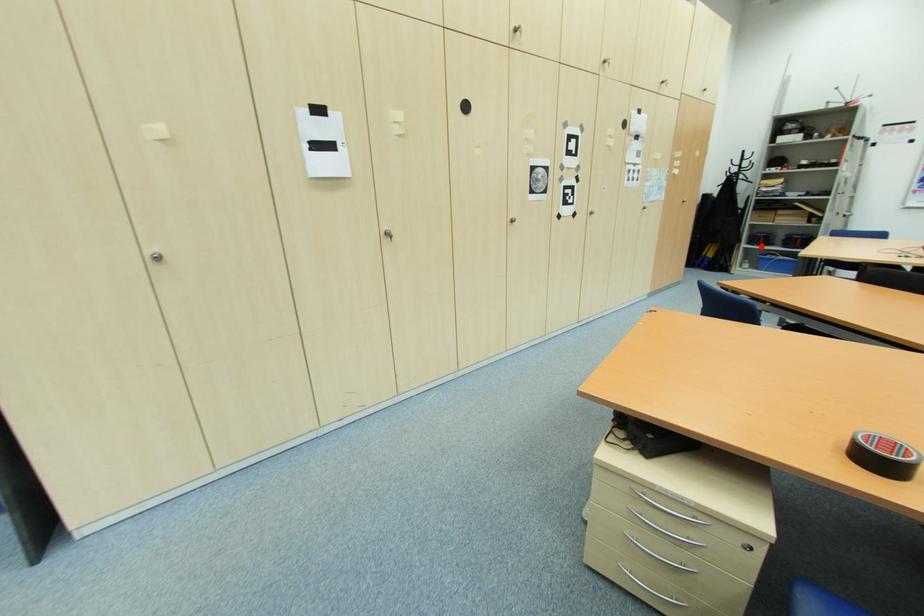
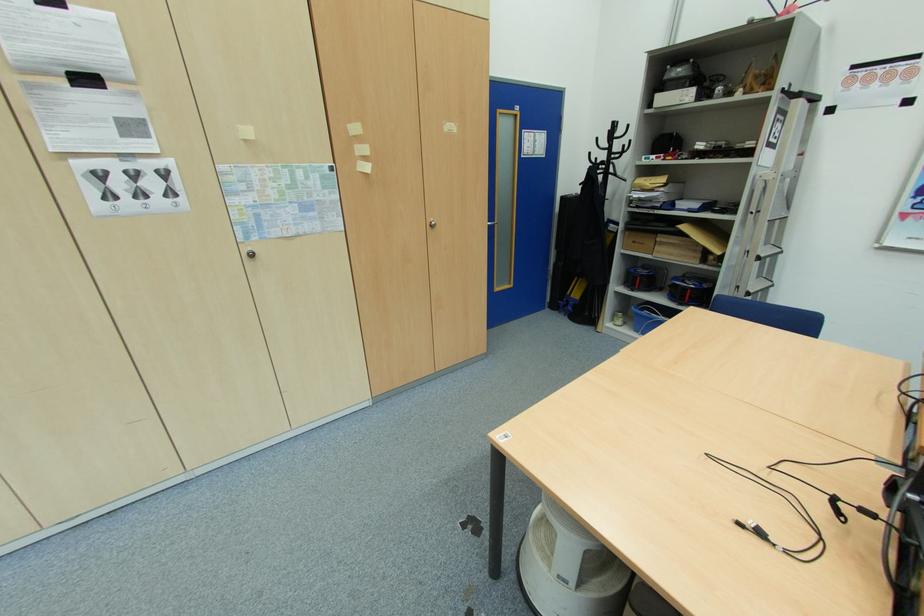
The point at the highlighted location is marked in the first image. Where is the corresponding point in the second image?

(637, 291)